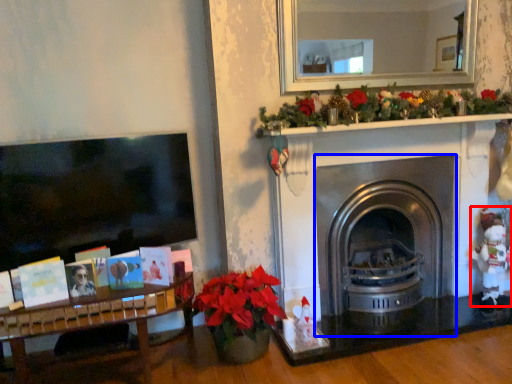
Question: Which object is closer to the camera taking this photo, toy (highlighted by a red box) or fireplace (highlighted by a blue box)?

Choices:
 (A) toy
 (B) fireplace

Answer: (B)